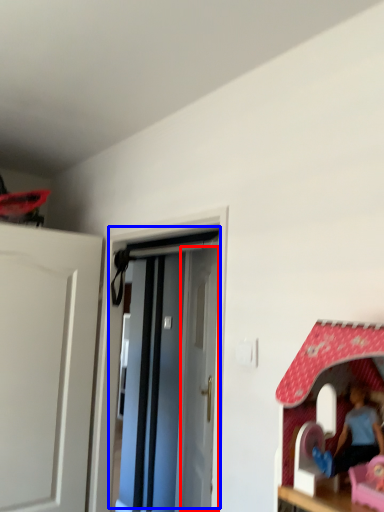
Question: Which object appears farthest to the camera in this image, door (highlighted by a red box) or door (highlighted by a blue box)?

Choices:
 (A) door
 (B) door

Answer: (A)